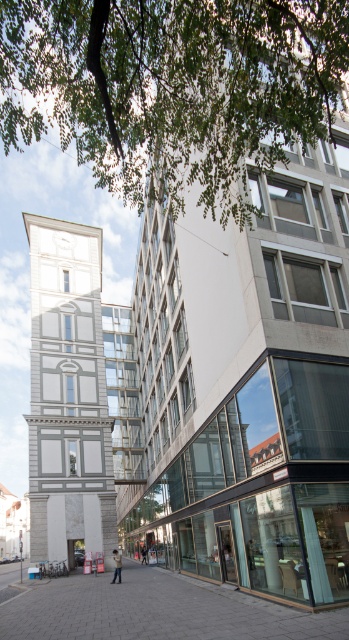
Who is lower down, paved stone sidewalk at center or dark blue jeans at center?

dark blue jeans at center

Is paved stone sidewalk at center smaller than dark blue jeans at center?

No.

Between point (195, 589) and point (144, 561), which one is positioned behind?

The point (144, 561) is more distant.

Where is `paved stone sidewalk at center`? The height and width of the screenshot is (640, 349). paved stone sidewalk at center is located at coordinates (156, 611).

Between light brown leather jacket at center and dark blue jeans at center, which one has less height?

dark blue jeans at center

Does light brown leather jacket at center appear on the right side of dark blue jeans at center?

Incorrect, light brown leather jacket at center is not on the right side of dark blue jeans at center.

Find the location of a particular element. Image resolution: width=349 pixels, height=640 pixels. light brown leather jacket at center is located at coordinates (116, 566).

Find the location of a particular element. light brown leather jacket at center is located at coordinates (116, 566).

Identify the location of paved stone sidewalk at center. (156, 611).

Which is below, paved stone sidewalk at center or light brown leather jacket at center?

light brown leather jacket at center

Describe the element at coordinates (156, 611) in the screenshot. I see `paved stone sidewalk at center` at that location.

Where is `paved stone sidewalk at center`? This screenshot has width=349, height=640. paved stone sidewalk at center is located at coordinates (156, 611).